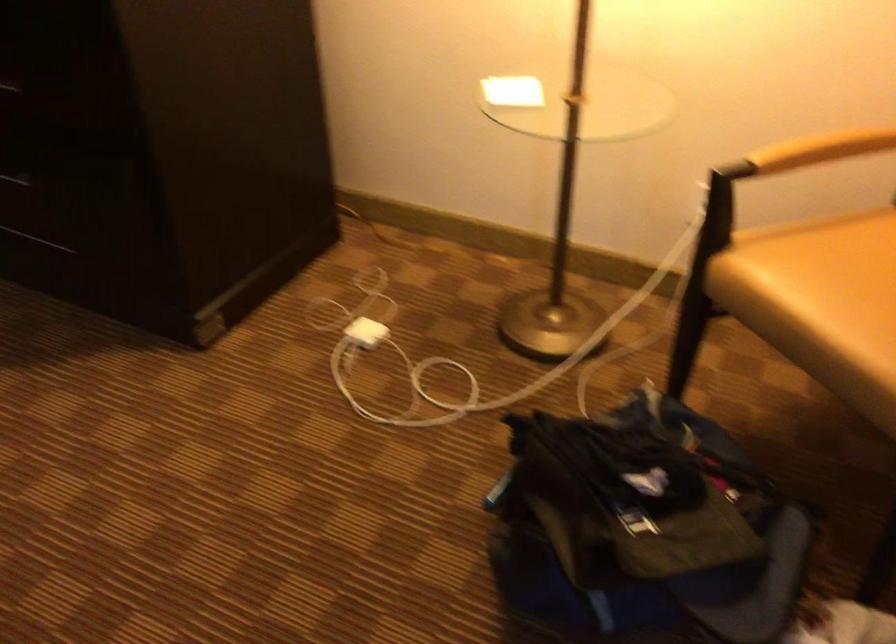
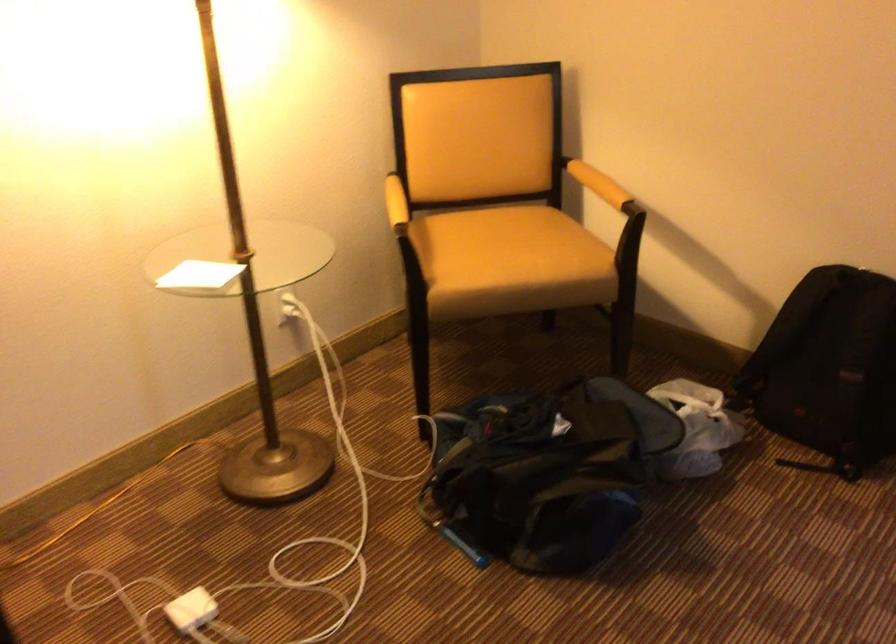
Where in the second image is the point corresponding to point (359, 335) from the first image?

(192, 609)